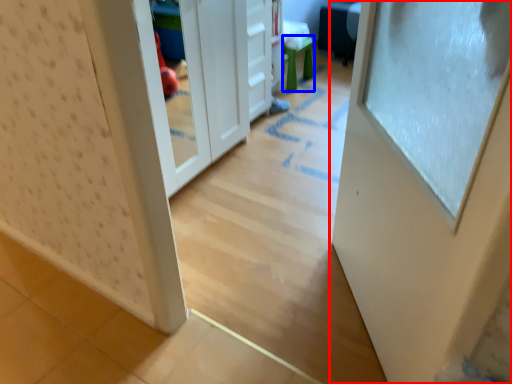
Question: Which object appears closest to the camera in this image, door (highlighted by a red box) or stool (highlighted by a blue box)?

Choices:
 (A) door
 (B) stool

Answer: (A)